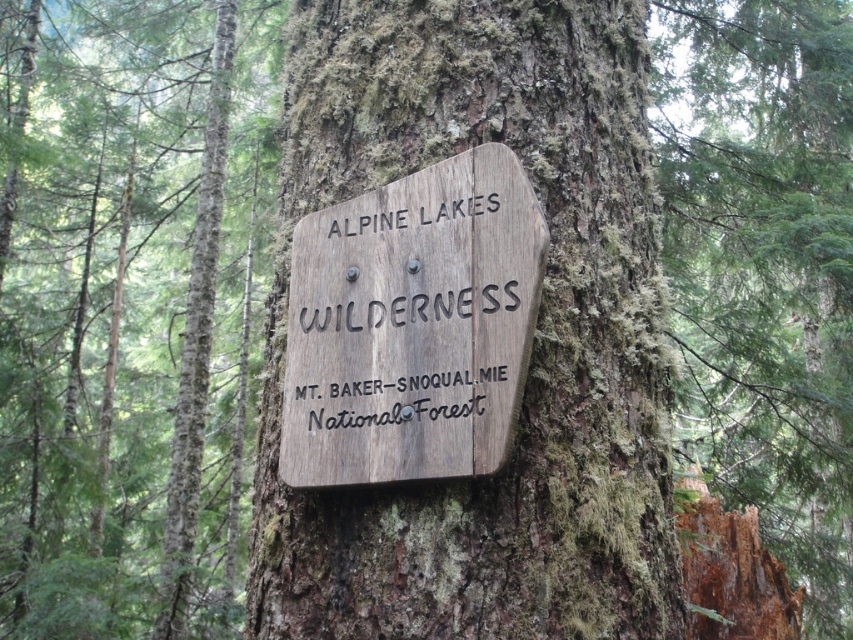
Between point (171, 600) and point (808, 349), which one is positioned in front?

Positioned in front is point (171, 600).

Is weathered wood sign at center to the left of brown rough bark at center from the viewer's perspective?

Indeed, weathered wood sign at center is positioned on the left side of brown rough bark at center.

Does point (248, 182) come in front of point (685, 148)?

No, it is not.

I want to click on weathered wood sign at center, so click(126, 307).

Find the location of a particular element. Image resolution: width=853 pixels, height=640 pixels. weathered wood sign at center is located at coordinates (126, 307).

Can you confirm if weathered wood sign at center is taller than wooden sign at center?

Correct, weathered wood sign at center is much taller as wooden sign at center.

Locate an element on the screen. The height and width of the screenshot is (640, 853). weathered wood sign at center is located at coordinates (126, 307).

In the scene shown: Is brown rough bark at center thinner than wooden sign at center?

Incorrect, brown rough bark at center's width is not less than wooden sign at center's.

Which is in front, point (759, 289) or point (442, 304)?

Point (442, 304)

Where is `brown rough bark at center`? brown rough bark at center is located at coordinates (764, 268).